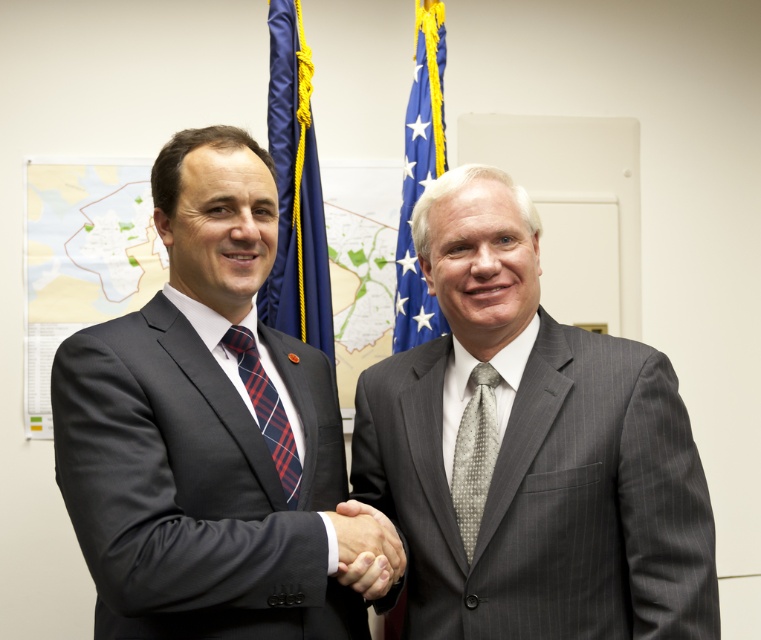
Can you confirm if blue fabric flag at upper center is bigger than plaid fabric tie at center?

Yes, blue fabric flag at upper center is bigger than plaid fabric tie at center.

In the scene shown: Is blue fabric flag at upper center behind plaid fabric tie at center?

That is True.

In order to click on blue fabric flag at upper center in this screenshot , I will do `click(419, 177)`.

Between dark gray suit at center and smooth skin handshake at center, which one appears on the right side from the viewer's perspective?

From the viewer's perspective, smooth skin handshake at center appears more on the right side.

Between point (91, 572) and point (360, 513), which one is positioned behind?

The point (360, 513) is behind.

The width and height of the screenshot is (761, 640). In order to click on dark gray suit at center in this screenshot , I will do (x=205, y=428).

Between dark gray suit at center and blue fabric flag at left, which one is positioned higher?

Positioned higher is blue fabric flag at left.

Looking at this image, who is more distant from viewer, (231, 465) or (268, 141)?

Point (268, 141)

Identify the location of dark gray suit at center. (205, 428).

Where is `dark gray suit at center`? dark gray suit at center is located at coordinates (205, 428).